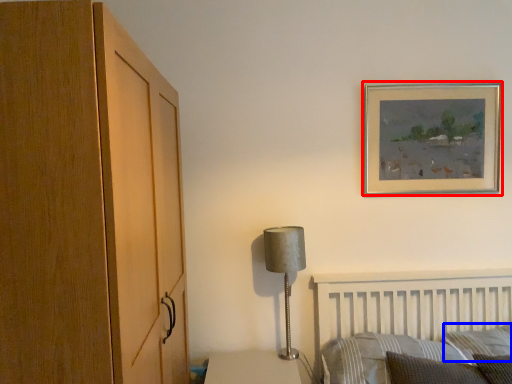
Question: Among these objects, which one is farthest to the camera, picture frame (highlighted by a red box) or pillow (highlighted by a blue box)?

Choices:
 (A) picture frame
 (B) pillow

Answer: (A)